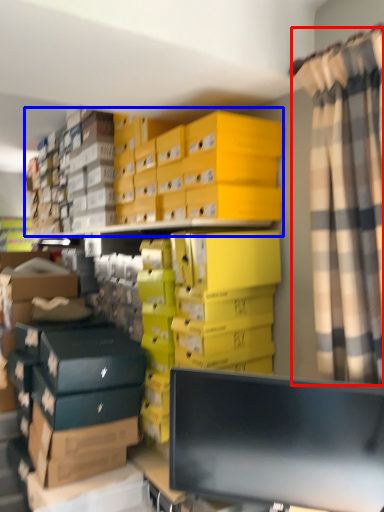
Question: Which object is further to the camera taking this photo, curtain (highlighted by a red box) or storage box (highlighted by a blue box)?

Choices:
 (A) curtain
 (B) storage box

Answer: (B)